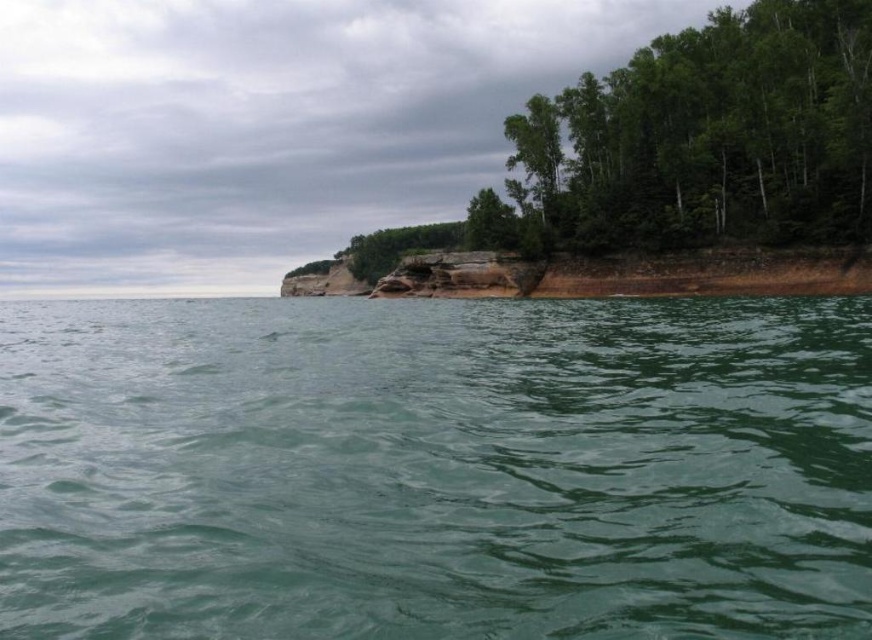
Is green smooth water at center closer to camera compared to green leafy trees at upper right?

Yes.

Does green smooth water at center have a lesser width compared to green leafy trees at upper right?

Incorrect, green smooth water at center's width is not less than green leafy trees at upper right's.

Is point (621, 520) positioned behind point (808, 186)?

No.

Where is `green smooth water at center`? green smooth water at center is located at coordinates (436, 468).